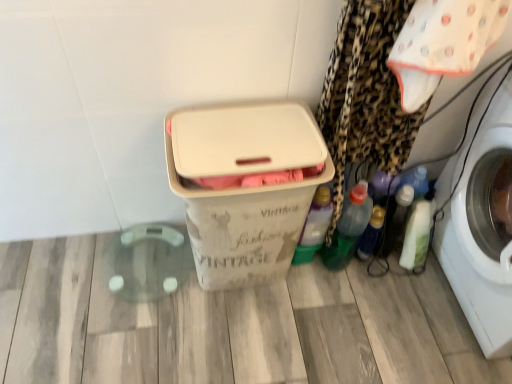
Identify the location of vacant space in front of translucent plastic bottle at lower right, the second bottle in the right-to-left sequence. (371, 294).